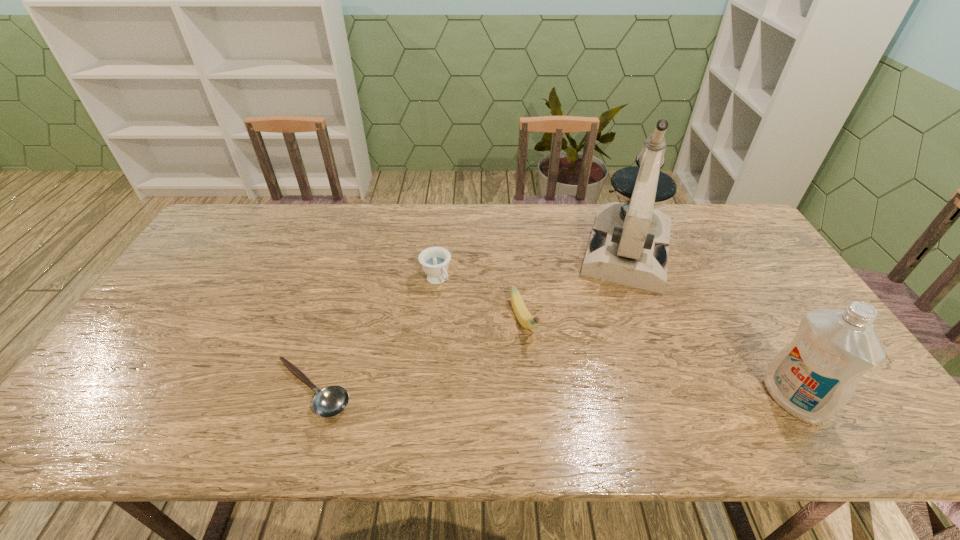
Find the location of a particular element. This screenshot has width=960, height=540. the leftmost object is located at coordinates (330, 401).

This screenshot has height=540, width=960. I want to click on the shortest object, so click(330, 401).

I want to click on the second tallest object, so click(x=813, y=378).

Where is `the rightmost object`? Image resolution: width=960 pixels, height=540 pixels. the rightmost object is located at coordinates (813, 378).

I want to click on the fourth object from right to left, so click(x=435, y=260).

Image resolution: width=960 pixels, height=540 pixels. Identify the location of the third nearest object. (524, 317).

Where is `the third object from left to right`? Image resolution: width=960 pixels, height=540 pixels. the third object from left to right is located at coordinates (524, 317).

Locate an element on the screen. the fourth object from left to right is located at coordinates (629, 245).

Locate an element on the screen. This screenshot has height=540, width=960. microscope is located at coordinates (629, 245).

The image size is (960, 540). Find the location of `vacant space situated 0.150m on the right of the ladle`. vacant space situated 0.150m on the right of the ladle is located at coordinates pos(418,389).